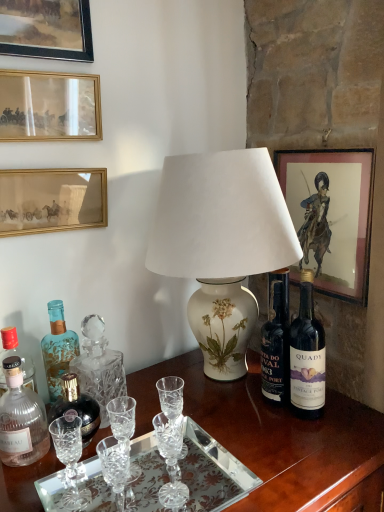
Question: From a real-world perspective, is wooden picture frame at upper left, marked as the 4th picture frame in a right-to-left arrangement, physically located above or below wooden desk at center?

Choices:
 (A) below
 (B) above

Answer: (B)

Question: Is point (39, 0) positioned closer to the camera than point (314, 438)?

Choices:
 (A) closer
 (B) farther

Answer: (B)

Question: Which of these objects is positioned closest to the matte glass picture frame at upper left, the 2th picture frame from the left?

Choices:
 (A) clear glass tray at lower center
 (B) wooden picture frame at upper left, arranged as the first picture frame when viewed from the left
 (C) translucent glass bottle at left, the third bottle viewed from the back
 (D) matte paper picture frame at upper right, acting as the 1th picture frame starting from the right
 (E) blue glass bottle at left, the first bottle positioned from the back

Answer: (B)

Question: Estimate the real-world distances between objects in this image. Which object is farther from the clear glass tray at lower center?

Choices:
 (A) dark glass bottle at right
 (B) translucent glass bottle at left, marked as the 1th bottle in a front-to-back arrangement
 (C) matte glass picture frame at upper left, the 2th picture frame from the left
 (D) wooden picture frame at upper left, marked as the 4th picture frame in a right-to-left arrangement
 (E) matte paper picture frame at upper right, acting as the 4th picture frame starting from the left

Answer: (D)